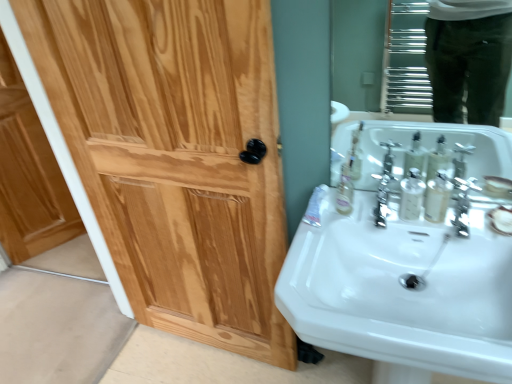
Question: Does glossy chrome mirror at upper right come in front of polished chrome faucet at center?

Choices:
 (A) no
 (B) yes

Answer: (B)

Question: From the image's perspective, is glossy chrome mirror at upper right on top of polished chrome faucet at center?

Choices:
 (A) no
 (B) yes

Answer: (B)

Question: Is polished chrome faucet at center at the back of glossy chrome mirror at upper right?

Choices:
 (A) no
 (B) yes

Answer: (A)

Question: Does glossy chrome mirror at upper right lie behind polished chrome faucet at center?

Choices:
 (A) yes
 (B) no

Answer: (B)

Question: Would you say glossy chrome mirror at upper right contains polished chrome faucet at center?

Choices:
 (A) no
 (B) yes

Answer: (A)

Question: In terms of size, does clear plastic mouthwash at right, which is the 1th mouthwash in left-to-right order, appear bigger or smaller than satin nickel faucet at right?

Choices:
 (A) big
 (B) small

Answer: (B)

Question: From their relative heights in the image, would you say clear plastic mouthwash at right, the second mouthwash from the right, is taller or shorter than satin nickel faucet at right?

Choices:
 (A) short
 (B) tall

Answer: (B)

Question: Is clear plastic mouthwash at right, the second mouthwash from the right, wider or thinner than satin nickel faucet at right?

Choices:
 (A) wide
 (B) thin

Answer: (B)

Question: Visually, is clear plastic mouthwash at right, which is the 1th mouthwash in left-to-right order, positioned to the left or to the right of satin nickel faucet at right?

Choices:
 (A) right
 (B) left

Answer: (B)

Question: Is polished chrome faucet at center to the left or to the right of white glossy tube at lower right in the image?

Choices:
 (A) left
 (B) right

Answer: (B)

Question: From the image's perspective, is polished chrome faucet at center located above or below white glossy tube at lower right?

Choices:
 (A) below
 (B) above

Answer: (A)

Question: Looking at the image, does polished chrome faucet at center seem bigger or smaller compared to white glossy tube at lower right?

Choices:
 (A) big
 (B) small

Answer: (A)

Question: From a real-world perspective, is polished chrome faucet at center physically located above or below white glossy tube at lower right?

Choices:
 (A) below
 (B) above

Answer: (B)

Question: In terms of size, does light brown wood door at left appear bigger or smaller than white glossy sink at lower right?

Choices:
 (A) small
 (B) big

Answer: (A)

Question: Looking at their shapes, would you say light brown wood door at left is wider or thinner than white glossy sink at lower right?

Choices:
 (A) thin
 (B) wide

Answer: (A)